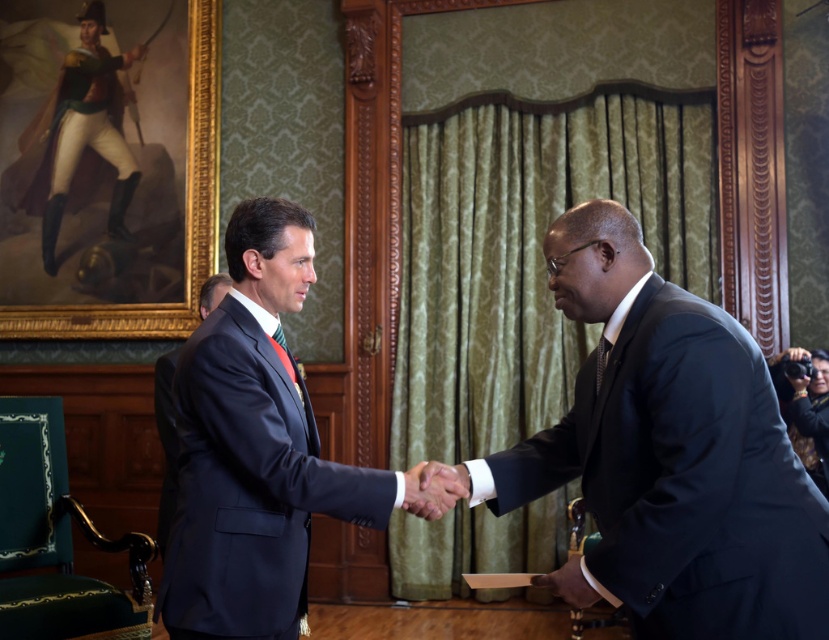
You are a photographer standing at point [90,29]. You need to take a photo of the two men shaking hands. Can you capture both of them in the frame without moving? Please explain your reasoning.

The two men are 5.44 meters apart. Since the photographer is at point [90,29], which is likely close to one of them, the distance between them might be too large to fit both in the frame without moving. However, without knowing the camera lens specifications, it is impossible to determine for sure. But based on typical camera angles, capturing both might be challenging due to their significant separation.